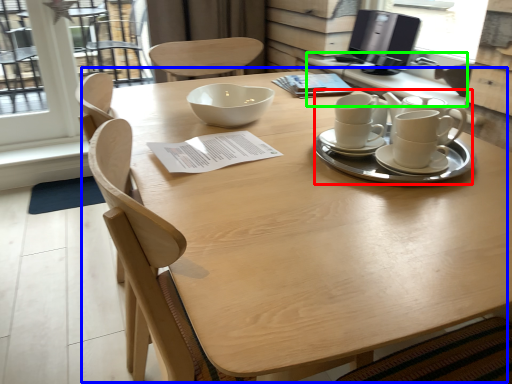
Question: Considering the real-world distances, which object is closest to tea set (highlighted by a red box)? table (highlighted by a blue box) or table (highlighted by a green box).

Choices:
 (A) table
 (B) table

Answer: (A)